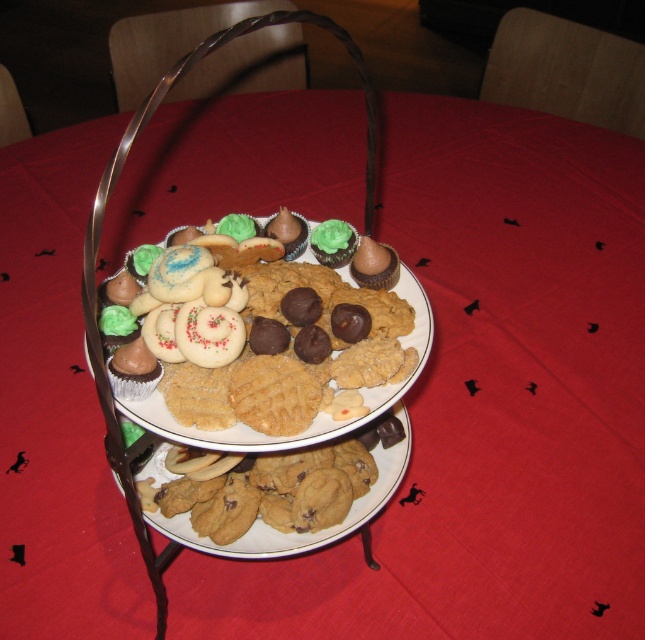
Between matte chocolate cookie at center and metallic silver basket at center, which one has more height?

Standing taller between the two is metallic silver basket at center.

Describe the element at coordinates (266, 355) in the screenshot. Image resolution: width=645 pixels, height=640 pixels. I see `matte chocolate cookie at center` at that location.

Where is `matte chocolate cookie at center`? This screenshot has width=645, height=640. matte chocolate cookie at center is located at coordinates (266, 355).